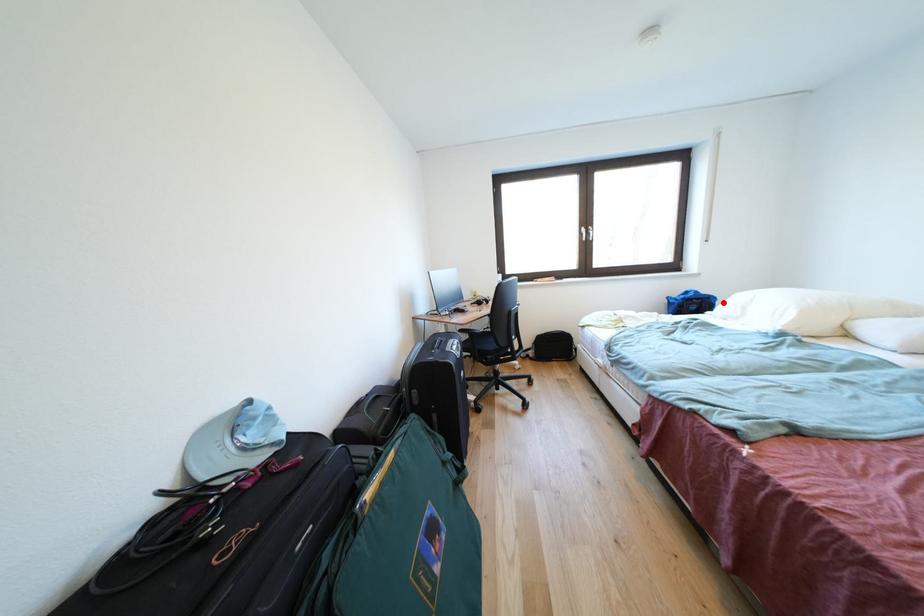
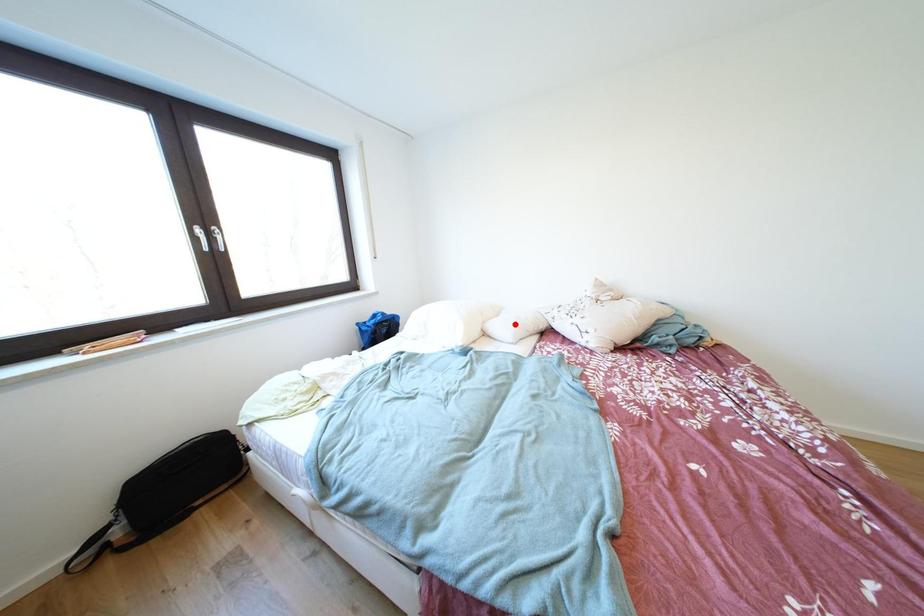
I am providing you with two images of the same scene from different viewpoints. A red point is marked on the first image and another point is marked on the second image. Are the points marked in image1 and image2 representing the same 3D position?

No